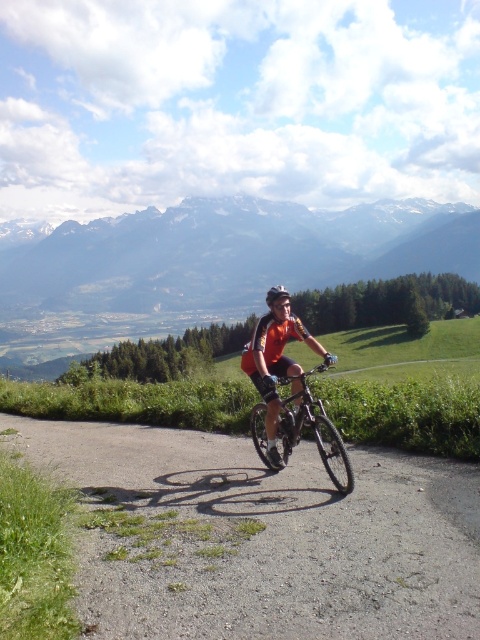
You are a cyclist on the road and you see two points marked on the road ahead of you. The first point is at coordinate point [145,234] and the second point is at coordinate point [259,444]. Which point is closer to you?

Point [145,234] is closer to you because it is further to the camera than point [259,444].

You are a cyclist on a paved road in a mountainous area. You see a point marked at coordinates (228, 253). Based on the scene, where is this point located?

The point at (228, 253) is located on the snowy mountain range at upper center.